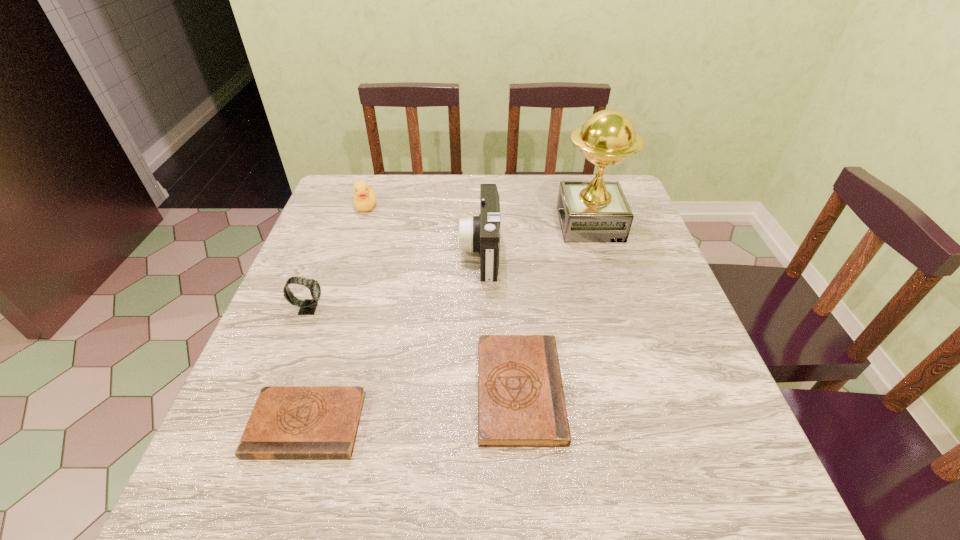
This screenshot has height=540, width=960. What are the coordinates of `free space located 0.250m on the face of the duckling` in the screenshot? It's located at (343, 275).

I want to click on vacant area located on the front-facing side of the rightmost object, so click(486, 224).

This screenshot has height=540, width=960. I want to click on vacant region located 0.360m on the front-facing side of the rightmost object, so click(428, 224).

At what (x,y) coordinates should I click in order to perform the action: click on blank area located 0.300m on the front-facing side of the rightmost object. Please return your answer as a coordinate pair (x, y). This screenshot has width=960, height=540. Looking at the image, I should click on (450, 224).

At what (x,y) coordinates should I click in order to perform the action: click on vacant point located 0.280m on the lens of the second tallest object. Please return your answer as a coordinate pair (x, y). This screenshot has width=960, height=540. Looking at the image, I should click on (352, 252).

The image size is (960, 540). In order to click on free location located on the lens of the second tallest object in this screenshot , I will do `click(379, 252)`.

Identify the location of free space located 0.130m on the lens of the second tallest object. (410, 252).

Where is `vacant space located 0.380m on the face of the watch`? The image size is (960, 540). vacant space located 0.380m on the face of the watch is located at coordinates (494, 309).

Identify the location of duckling that is positioned at the far edge. The image size is (960, 540). (365, 198).

Locate an element on the screen. The width and height of the screenshot is (960, 540). award that is at the far edge is located at coordinates (597, 211).